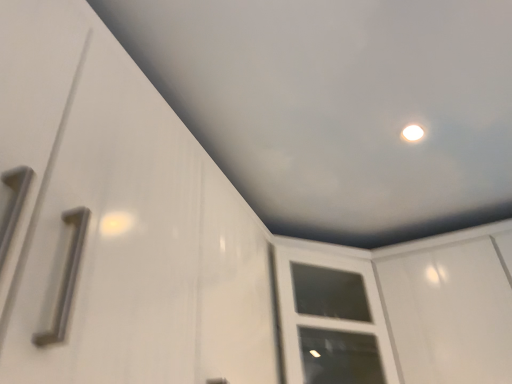
The height and width of the screenshot is (384, 512). What do you see at coordinates (450, 313) in the screenshot?
I see `white glossy screen door at upper right` at bounding box center [450, 313].

I want to click on white glossy screen door at upper right, so click(x=450, y=313).

In order to click on white glossy cabinet door at center in this screenshot , I will do `click(331, 320)`.

Image resolution: width=512 pixels, height=384 pixels. What do you see at coordinates (331, 320) in the screenshot?
I see `white glossy cabinet door at center` at bounding box center [331, 320].

This screenshot has height=384, width=512. I want to click on white glossy screen door at upper right, so click(x=450, y=313).

Which object is positioned more to the left, white glossy screen door at upper right or white glossy cabinet door at center?

From the viewer's perspective, white glossy cabinet door at center appears more on the left side.

Based on the photo, in the image, is white glossy screen door at upper right positioned in front of or behind white glossy cabinet door at center?

white glossy screen door at upper right is positioned closer to the viewer than white glossy cabinet door at center.

Does point (504, 265) appear closer or farther from the camera than point (327, 296)?

Point (504, 265) appears to be closer to the viewer than point (327, 296).

From the image's perspective, who appears lower, white glossy screen door at upper right or white glossy cabinet door at center?

white glossy cabinet door at center, from the image's perspective.

From a real-world perspective, which object stands above the other?

In real-world perspective, white glossy cabinet door at center is above.

Considering the sizes of objects white glossy screen door at upper right and white glossy cabinet door at center in the image provided, who is thinner, white glossy screen door at upper right or white glossy cabinet door at center?

white glossy screen door at upper right is thinner.

Considering the relative sizes of white glossy screen door at upper right and white glossy cabinet door at center in the image provided, is white glossy screen door at upper right shorter than white glossy cabinet door at center?

No, white glossy screen door at upper right is not shorter than white glossy cabinet door at center.

Who is smaller, white glossy screen door at upper right or white glossy cabinet door at center?

white glossy screen door at upper right.

Looking at this image, is white glossy screen door at upper right positioned beyond the bounds of white glossy cabinet door at center?

Yes.

Is white glossy screen door at upper right not near white glossy cabinet door at center?

That's not correct — white glossy screen door at upper right is a little close to white glossy cabinet door at center.

Is white glossy screen door at upper right facing away from white glossy cabinet door at center?

That's not correct — white glossy screen door at upper right is not looking away from white glossy cabinet door at center.

How many degrees apart are the facing directions of white glossy screen door at upper right and white glossy cabinet door at center?

They differ by 36.8 degrees in their facing directions.

Measure the distance from white glossy screen door at upper right to white glossy cabinet door at center.

white glossy screen door at upper right and white glossy cabinet door at center are 9.65 inches apart from each other.

Identify the location of window frame below the white glossy screen door at upper right (from the image's perspective). (331, 320).

Between white glossy cabinet door at center and white glossy screen door at upper right, which one appears on the right side from the viewer's perspective?

white glossy screen door at upper right.

Is white glossy cabinet door at center positioned in front of white glossy screen door at upper right?

No, it is behind white glossy screen door at upper right.

Is point (343, 367) positioned before point (426, 311)?

No, it is not.

From the image's perspective, between white glossy cabinet door at center and white glossy screen door at upper right, which one is located above?

From the image's view, white glossy screen door at upper right is above.

From a real-world perspective, between white glossy cabinet door at center and white glossy screen door at upper right, who is vertically lower?

white glossy screen door at upper right.

Considering the relative sizes of white glossy cabinet door at center and white glossy screen door at upper right in the image provided, is white glossy cabinet door at center thinner than white glossy screen door at upper right?

Incorrect, the width of white glossy cabinet door at center is not less than that of white glossy screen door at upper right.

Considering the relative sizes of white glossy cabinet door at center and white glossy screen door at upper right in the image provided, is white glossy cabinet door at center taller than white glossy screen door at upper right?

Incorrect, the height of white glossy cabinet door at center is not larger of that of white glossy screen door at upper right.

Is white glossy cabinet door at center smaller than white glossy screen door at upper right?

Incorrect, white glossy cabinet door at center is not smaller in size than white glossy screen door at upper right.

Is white glossy cabinet door at center outside of white glossy screen door at upper right?

Yes, white glossy cabinet door at center is located beyond the bounds of white glossy screen door at upper right.

Is white glossy cabinet door at center in contact with white glossy screen door at upper right?

They are not placed beside each other.

Could you tell me if white glossy cabinet door at center is facing white glossy screen door at upper right?

No, white glossy cabinet door at center is not aimed at white glossy screen door at upper right.

How different are the orientations of white glossy cabinet door at center and white glossy screen door at upper right in degrees?

They differ by 36.8 degrees in their facing directions.

How much distance is there between white glossy cabinet door at center and white glossy screen door at upper right?

white glossy cabinet door at center is 9.65 inches away from white glossy screen door at upper right.

Where is `window frame located above the white glossy screen door at upper right (from a real-world perspective)`? This screenshot has height=384, width=512. window frame located above the white glossy screen door at upper right (from a real-world perspective) is located at coordinates (331, 320).

At what (x,y) coordinates should I click in order to perform the action: click on screen door lying in front of the white glossy cabinet door at center. Please return your answer as a coordinate pair (x, y). This screenshot has height=384, width=512. Looking at the image, I should click on click(450, 313).

Where is `screen door lying above the white glossy cabinet door at center (from the image's perspective)`? Image resolution: width=512 pixels, height=384 pixels. screen door lying above the white glossy cabinet door at center (from the image's perspective) is located at coordinates (450, 313).